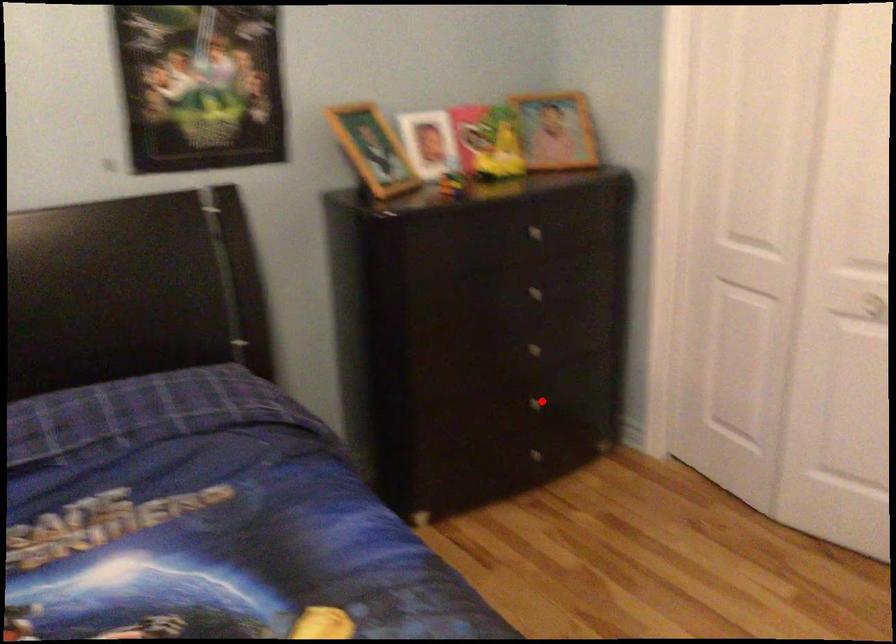
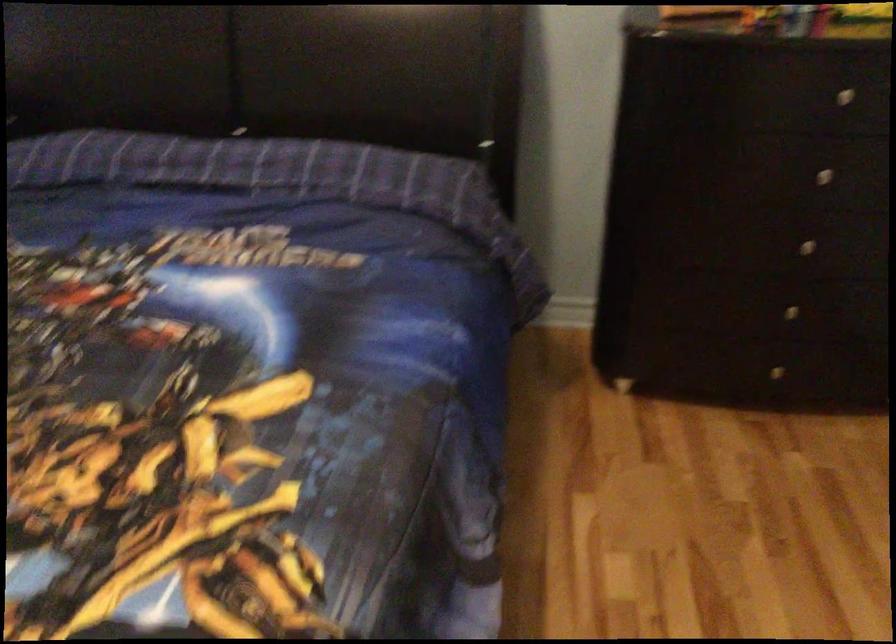
Question: I am providing you with two images of the same scene from different viewpoints. In image1, a red point is highlighted. Considering the same 3D point in image2, which of the following is correct?

Choices:
 (A) It is closer
 (B) It is farther

Answer: (A)